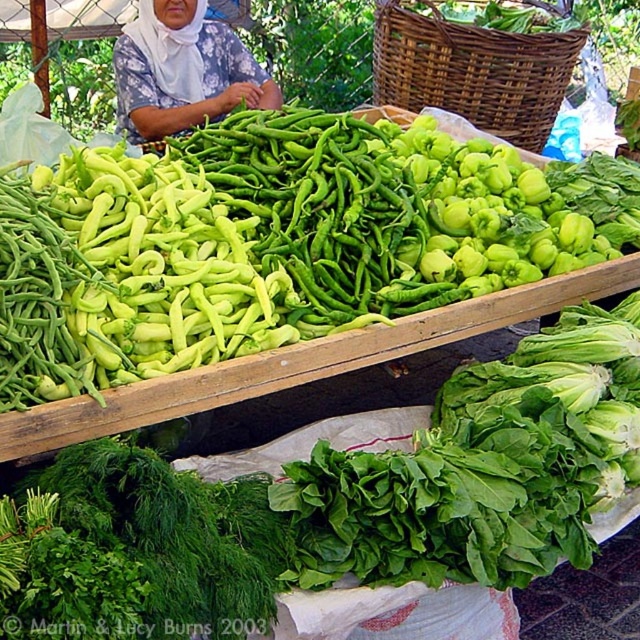
Question: In this image, where is green matte peppers at upper left located relative to woven brown basket at upper center?

Choices:
 (A) left
 (B) right

Answer: (A)

Question: Does green matte peppers at upper left lie behind woven brown basket at upper center?

Choices:
 (A) yes
 (B) no

Answer: (B)

Question: Which point is closer to the camera?

Choices:
 (A) (220, 49)
 (B) (278, 216)
 (C) (429, 42)

Answer: (B)

Question: Is green matte peppers at upper left in front of white cloth headscarf at upper center?

Choices:
 (A) yes
 (B) no

Answer: (A)

Question: Which object appears closest to the camera in this image?

Choices:
 (A) woven brown basket at upper center
 (B) green matte peppers at upper left

Answer: (B)

Question: Among these objects, which one is farthest from the camera?

Choices:
 (A) white cloth headscarf at upper center
 (B) woven brown basket at upper center
 (C) green matte peppers at upper left

Answer: (A)